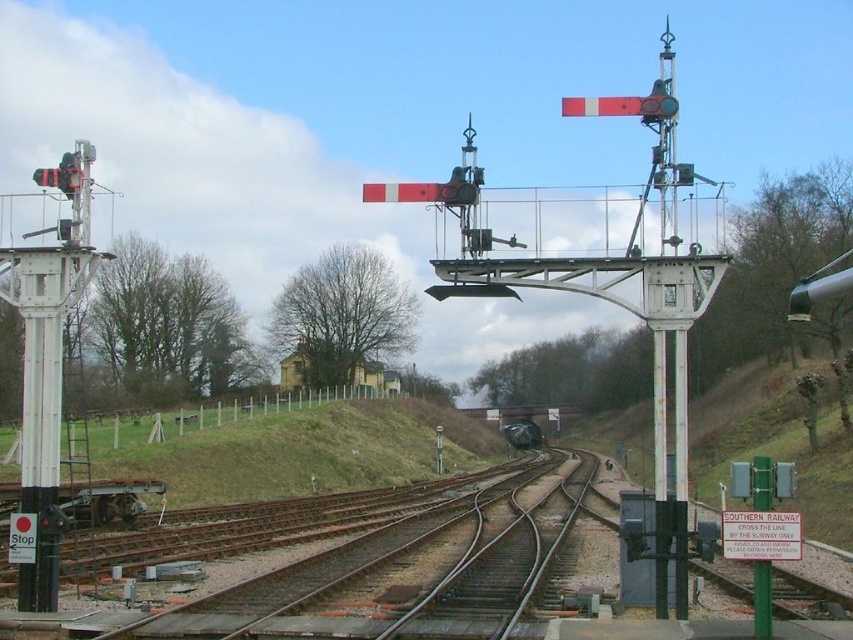
Question: Which object is farther from the camera taking this photo?

Choices:
 (A) brown metal train track at center
 (B) metallic gray train at center

Answer: (B)

Question: Observing the image, what is the correct spatial positioning of brown metal train track at center in reference to metallic gray train at center?

Choices:
 (A) below
 (B) above

Answer: (B)

Question: Is brown metal train track at center below metallic gray train at center?

Choices:
 (A) no
 (B) yes

Answer: (A)

Question: Is brown metal train track at center below metallic gray train at center?

Choices:
 (A) yes
 (B) no

Answer: (B)